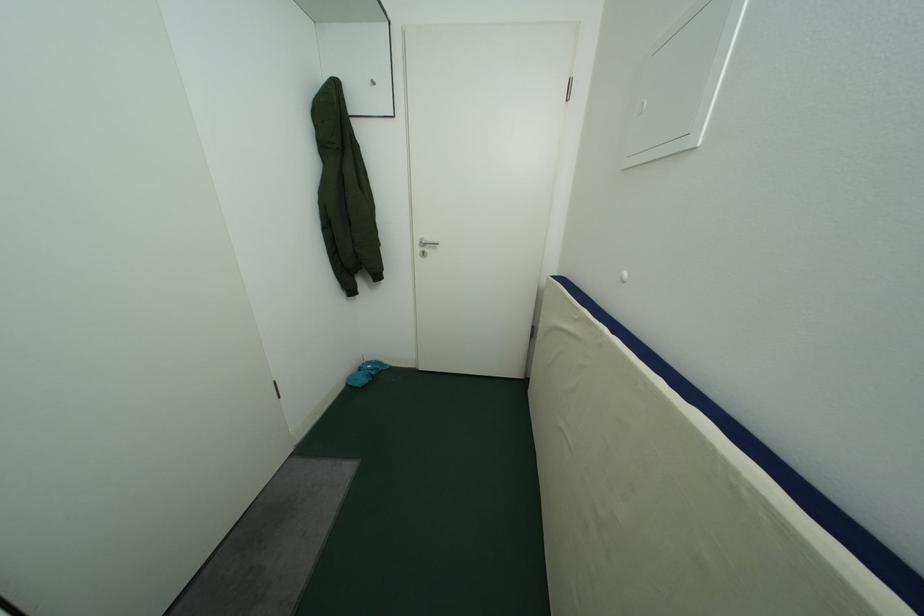
This screenshot has width=924, height=616. What do you see at coordinates (372, 82) in the screenshot?
I see `a silver wall hook` at bounding box center [372, 82].